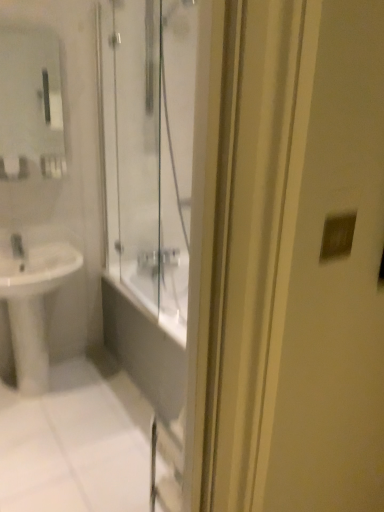
Question: Can you confirm if matte silver switch at upper right is thinner than white glossy sink at lower left?

Choices:
 (A) yes
 (B) no

Answer: (A)

Question: Is the position of matte silver switch at upper right less distant than that of white glossy sink at lower left?

Choices:
 (A) no
 (B) yes

Answer: (B)

Question: Is matte silver switch at upper right far from white glossy sink at lower left?

Choices:
 (A) no
 (B) yes

Answer: (B)

Question: From the image's perspective, is matte silver switch at upper right located beneath white glossy sink at lower left?

Choices:
 (A) no
 (B) yes

Answer: (A)

Question: Does matte silver switch at upper right have a greater height compared to white glossy sink at lower left?

Choices:
 (A) no
 (B) yes

Answer: (A)

Question: From a real-world perspective, relative to matte glass mirror at upper left, is white glossy sink at lower left vertically above or below?

Choices:
 (A) below
 (B) above

Answer: (A)

Question: Does point (46, 236) appear closer or farther from the camera than point (46, 35)?

Choices:
 (A) farther
 (B) closer

Answer: (B)

Question: Considering their positions, is white glossy sink at lower left located in front of or behind matte glass mirror at upper left?

Choices:
 (A) behind
 (B) front

Answer: (B)

Question: In terms of height, does white glossy sink at lower left look taller or shorter compared to matte glass mirror at upper left?

Choices:
 (A) short
 (B) tall

Answer: (B)

Question: In terms of height, does white glossy sink at lower left look taller or shorter compared to matte silver switch at upper right?

Choices:
 (A) short
 (B) tall

Answer: (B)

Question: From the image's perspective, is white glossy sink at lower left located above or below matte silver switch at upper right?

Choices:
 (A) above
 (B) below

Answer: (B)

Question: Considering the positions of white glossy sink at lower left and matte silver switch at upper right in the image, is white glossy sink at lower left bigger or smaller than matte silver switch at upper right?

Choices:
 (A) small
 (B) big

Answer: (B)

Question: Is point (16, 358) positioned closer to the camera than point (327, 258)?

Choices:
 (A) farther
 (B) closer

Answer: (A)

Question: In terms of width, does matte glass mirror at upper left look wider or thinner when compared to matte silver switch at upper right?

Choices:
 (A) wide
 (B) thin

Answer: (A)

Question: Is matte glass mirror at upper left bigger or smaller than matte silver switch at upper right?

Choices:
 (A) big
 (B) small

Answer: (A)